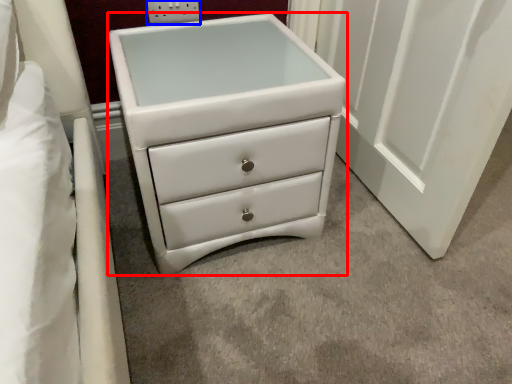
Question: Among these objects, which one is nearest to the camera, chest of drawers (highlighted by a red box) or electric outlet (highlighted by a blue box)?

Choices:
 (A) chest of drawers
 (B) electric outlet

Answer: (A)